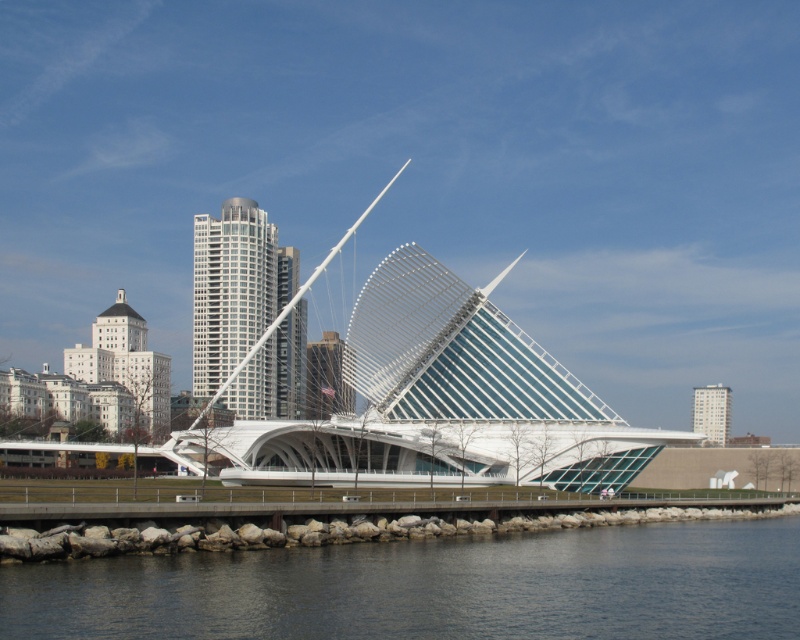
You are a visitor standing on the walkway near the dark blue water at lower center and want to cross to the white glass pedestrian bridge at center. Can you step directly from the walkway onto the bridge without needing to go around?

The dark blue water at lower center has a larger size compared to white glass pedestrian bridge at center, so there is enough space between them for you to step directly onto the bridge from the walkway.

You are standing at the point closer to the walkway on the grassy area. Which point, point (662,560) or point (574,472), is closer to you?

Point (662,560) is in front of point (574,472), so it is closer to you.

You are standing on the concrete walkway near the dark blue water at lower center and want to cross to the other side. Is the white glass pedestrian bridge at center between you and the water?

The dark blue water at lower center is in front of the white glass pedestrian bridge at center, so the bridge is not between you and the water. You would need to go around the bridge to reach the water.